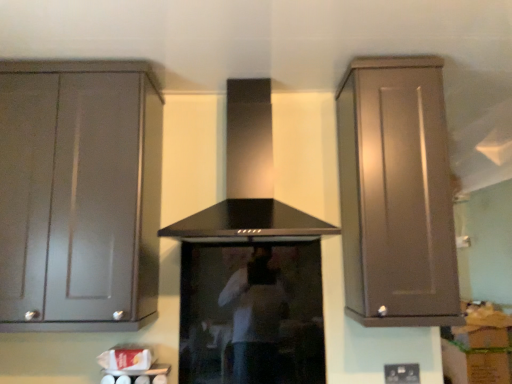
Question: From a real-world perspective, is black matte vent at center physically below black plastic electric outlet at lower center?

Choices:
 (A) no
 (B) yes

Answer: (A)

Question: From the image's perspective, is black matte vent at center located beneath black plastic electric outlet at lower center?

Choices:
 (A) no
 (B) yes

Answer: (A)

Question: Is black matte vent at center with black plastic electric outlet at lower center?

Choices:
 (A) no
 (B) yes

Answer: (A)

Question: Is black matte vent at center at the right side of black plastic electric outlet at lower center?

Choices:
 (A) yes
 (B) no

Answer: (B)

Question: Could you tell me if black matte vent at center is turned towards black plastic electric outlet at lower center?

Choices:
 (A) no
 (B) yes

Answer: (A)

Question: Is matte brown cabinet at right, which is counted as the 2th cabinetry, starting from the left, bigger or smaller than black plastic electric outlet at lower center?

Choices:
 (A) small
 (B) big

Answer: (B)

Question: Is matte brown cabinet at right, marked as the 1th cabinetry in a right-to-left arrangement, to the left or to the right of black plastic electric outlet at lower center in the image?

Choices:
 (A) left
 (B) right

Answer: (A)

Question: From the image's perspective, is matte brown cabinet at right, marked as the 1th cabinetry in a right-to-left arrangement, located above or below black plastic electric outlet at lower center?

Choices:
 (A) above
 (B) below

Answer: (A)

Question: In the image, is matte brown cabinet at right, which is counted as the 2th cabinetry, starting from the left, positioned in front of or behind black plastic electric outlet at lower center?

Choices:
 (A) front
 (B) behind

Answer: (A)

Question: Based on their positions, is matte gray cabinet at left, the 2th cabinetry viewed from the right, located to the left or right of black plastic electric outlet at lower center?

Choices:
 (A) left
 (B) right

Answer: (A)

Question: Is matte gray cabinet at left, arranged as the first cabinetry when viewed from the left, taller or shorter than black plastic electric outlet at lower center?

Choices:
 (A) tall
 (B) short

Answer: (A)

Question: Considering the positions of matte gray cabinet at left, arranged as the first cabinetry when viewed from the left, and black plastic electric outlet at lower center in the image, is matte gray cabinet at left, arranged as the first cabinetry when viewed from the left, wider or thinner than black plastic electric outlet at lower center?

Choices:
 (A) thin
 (B) wide

Answer: (B)

Question: From a real-world perspective, is matte gray cabinet at left, the 2th cabinetry viewed from the right, above or below black plastic electric outlet at lower center?

Choices:
 (A) above
 (B) below

Answer: (A)

Question: From a real-world perspective, is black plastic electric outlet at lower center above or below black glass stove at center?

Choices:
 (A) above
 (B) below

Answer: (B)

Question: Would you say black plastic electric outlet at lower center is to the left or to the right of black glass stove at center in the picture?

Choices:
 (A) left
 (B) right

Answer: (B)